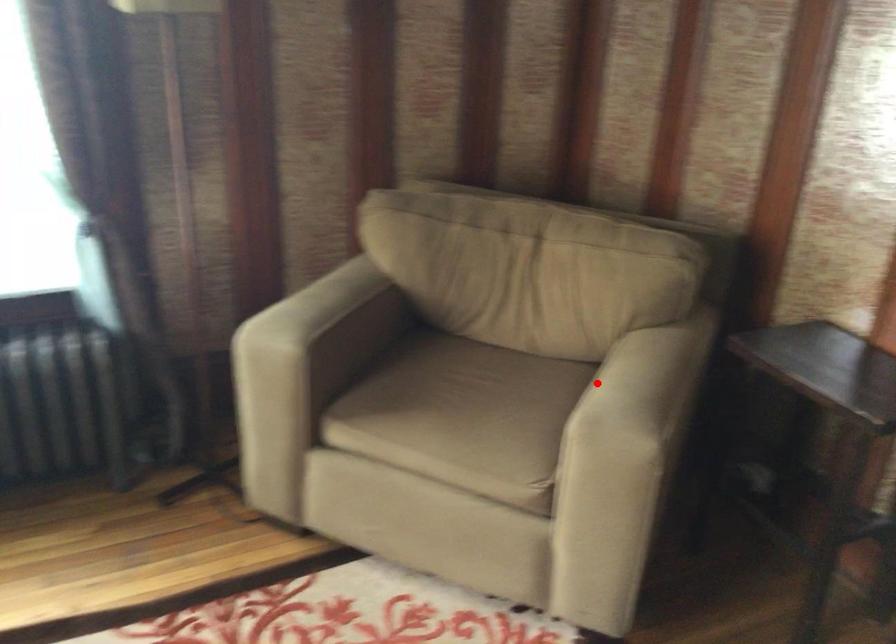
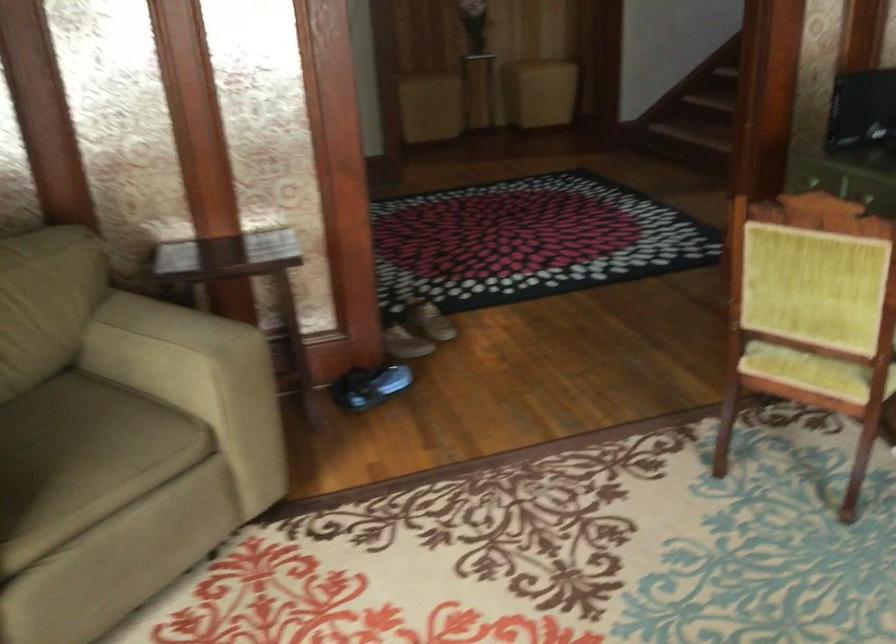
Question: I am providing you with two images of the same scene from different viewpoints. Given a red point in image1, look at the same physical point in image2. Is it:

Choices:
 (A) Closer to the viewpoint
 (B) Farther from the viewpoint

Answer: (B)